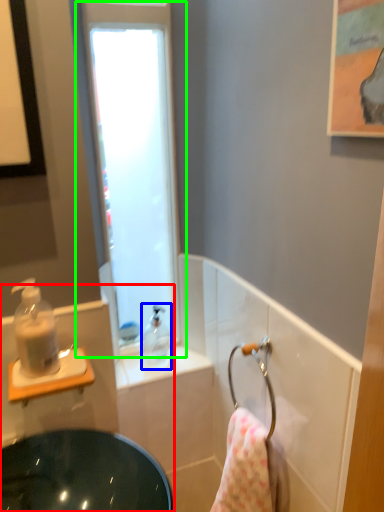
Question: Based on their relative distances, which object is farther from sink (highlighted by a red box)? Choose from soap dispenser (highlighted by a blue box) and window (highlighted by a green box).

Choices:
 (A) soap dispenser
 (B) window

Answer: (B)